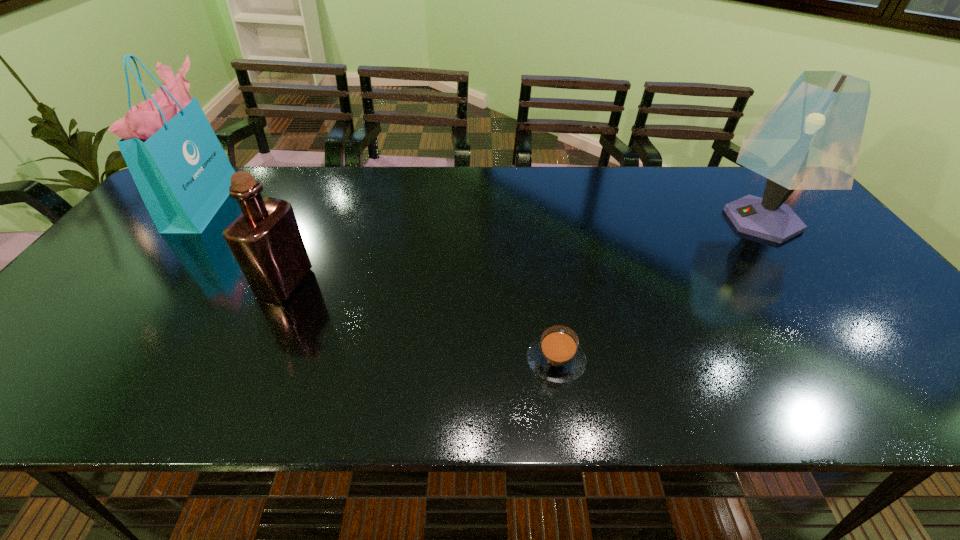
This screenshot has height=540, width=960. Find the location of `the leftmost object`. the leftmost object is located at coordinates (182, 173).

At what (x,y) coordinates should I click in order to perform the action: click on lampshade. Please return your answer as a coordinate pair (x, y). This screenshot has width=960, height=540. Looking at the image, I should click on (810, 139).

Identify the location of the second object from left to right. This screenshot has width=960, height=540. (266, 241).

This screenshot has width=960, height=540. I want to click on the third tallest object, so click(x=266, y=241).

Image resolution: width=960 pixels, height=540 pixels. I want to click on the third object from left to right, so click(556, 356).

Where is `the shortest object`? the shortest object is located at coordinates (556, 356).

I want to click on blank area located on the left of the leftmost object, so click(x=165, y=202).

Identify the location of vacant space situated on the base of the rightmost object. Image resolution: width=960 pixels, height=540 pixels. (677, 220).

At what (x,y) coordinates should I click in order to perform the action: click on vacant region located 0.070m on the base of the rightmost object. Please return your answer as a coordinate pair (x, y). Looking at the image, I should click on (687, 220).

Image resolution: width=960 pixels, height=540 pixels. Identify the location of vacant space located 0.170m on the base of the rightmost object. (653, 220).